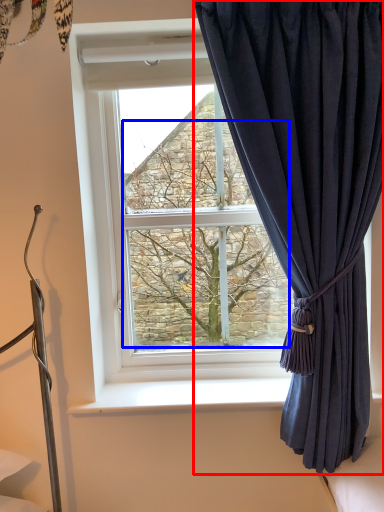
Question: Which of the following is the closest to the observer, curtain (highlighted by a red box) or tree (highlighted by a blue box)?

Choices:
 (A) curtain
 (B) tree

Answer: (A)